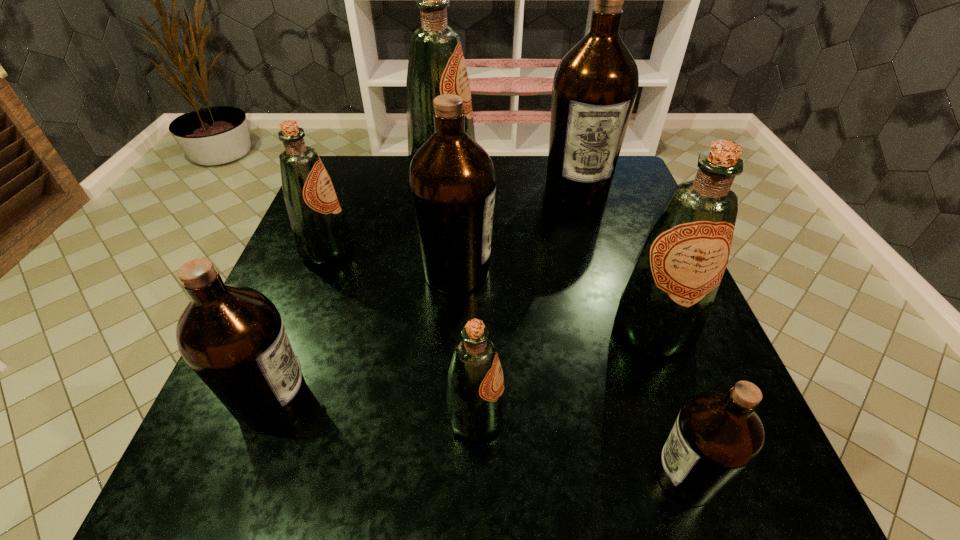
The width and height of the screenshot is (960, 540). In order to click on vacant space at the near left corner of the desktop in this screenshot , I will do `click(275, 471)`.

The height and width of the screenshot is (540, 960). What are the coordinates of `free point between the second farthest brown olive oil and the third farthest brown olive oil` in the screenshot? It's located at (365, 336).

The height and width of the screenshot is (540, 960). Identify the location of free space between the third smallest green olive oil and the third nearest brown olive oil. (555, 300).

You are a GUI agent. You are given a task and a screenshot of the screen. Output one action in this format:
    pyautogui.click(x=<x>, y=<y>)
    Task: Click on the unoccupied position between the farthest green olive oil and the farthest brown olive oil
    
    Given the screenshot: What is the action you would take?
    pyautogui.click(x=511, y=180)

You are a GUI agent. You are given a task and a screenshot of the screen. Output one action in this format:
    pyautogui.click(x=<x>, y=<y>)
    Task: Click on the vacant space in between the third farthest brown olive oil and the farthest green olive oil
    The width and height of the screenshot is (960, 540).
    Given the screenshot: What is the action you would take?
    pyautogui.click(x=358, y=287)

The height and width of the screenshot is (540, 960). I want to click on vacant space that's between the second smallest brown olive oil and the smallest green olive oil, so click(x=374, y=409).

Locate an element on the screen. empty space that is in between the biggest green olive oil and the rightmost green olive oil is located at coordinates (548, 250).

Find the location of a particular element. This screenshot has height=540, width=960. vacant space that is in between the nearest brown olive oil and the second brown olive oil from left to right is located at coordinates (571, 374).

Locate an element on the screen. This screenshot has height=540, width=960. vacant area that lies between the smallest green olive oil and the third nearest green olive oil is located at coordinates (401, 333).

Where is `free area in between the second nearest green olive oil and the farthest brown olive oil`? The height and width of the screenshot is (540, 960). free area in between the second nearest green olive oil and the farthest brown olive oil is located at coordinates (615, 258).